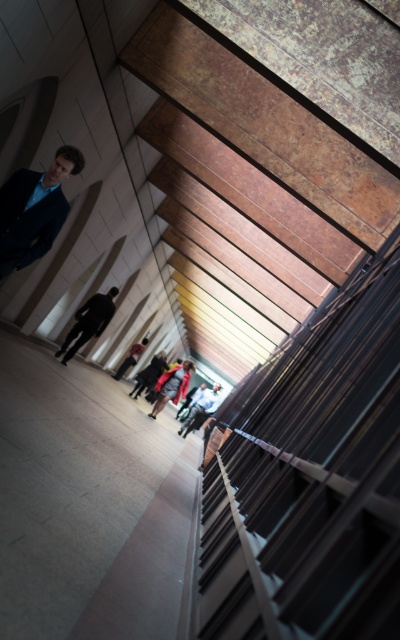
You are standing in this modern architectural space and notice a red velvet backpack at center and a white fabric jacket at center. Which object is nearer to you?

The red velvet backpack at center is closer to the viewer than the white fabric jacket at center.

You are standing in the modern architectural interior space looking up at the ceiling. There is a point marked at coordinates (34, 209). What object or feature is located at this point?

The matte blue suit at upper left is located at point (34, 209).